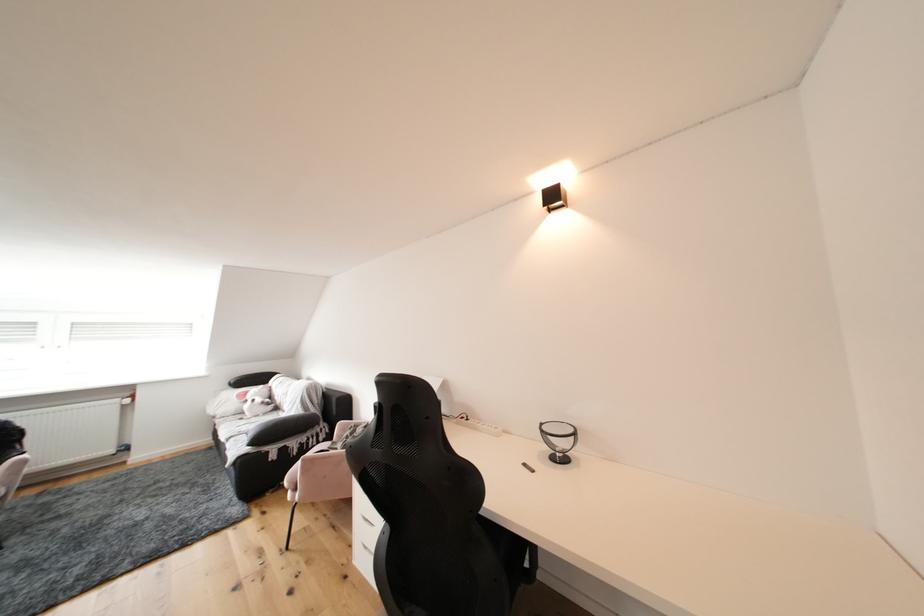
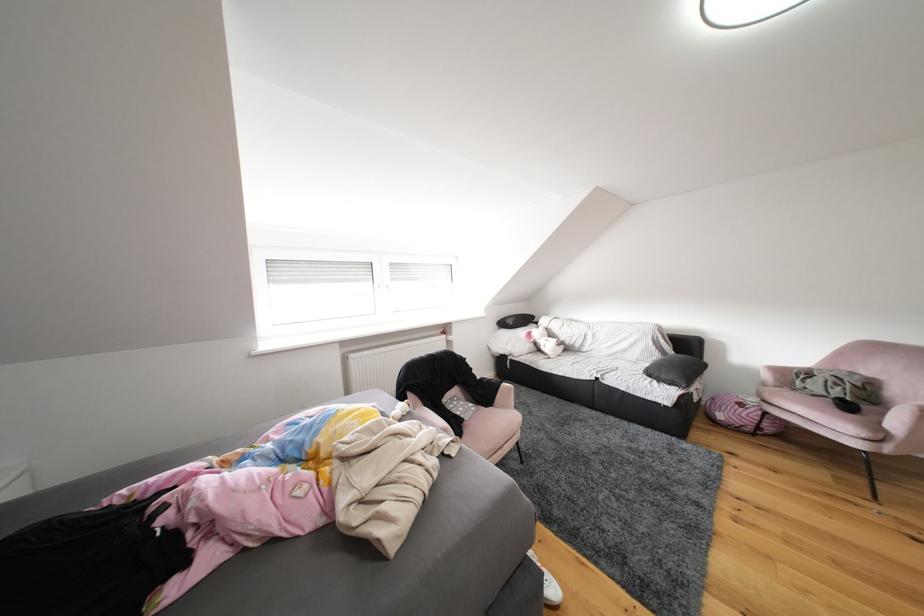
Question: The images are taken continuously from a first-person perspective. In which direction are you moving?

Choices:
 (A) Left
 (B) Right
 (C) Forward
 (D) Backward

Answer: (A)